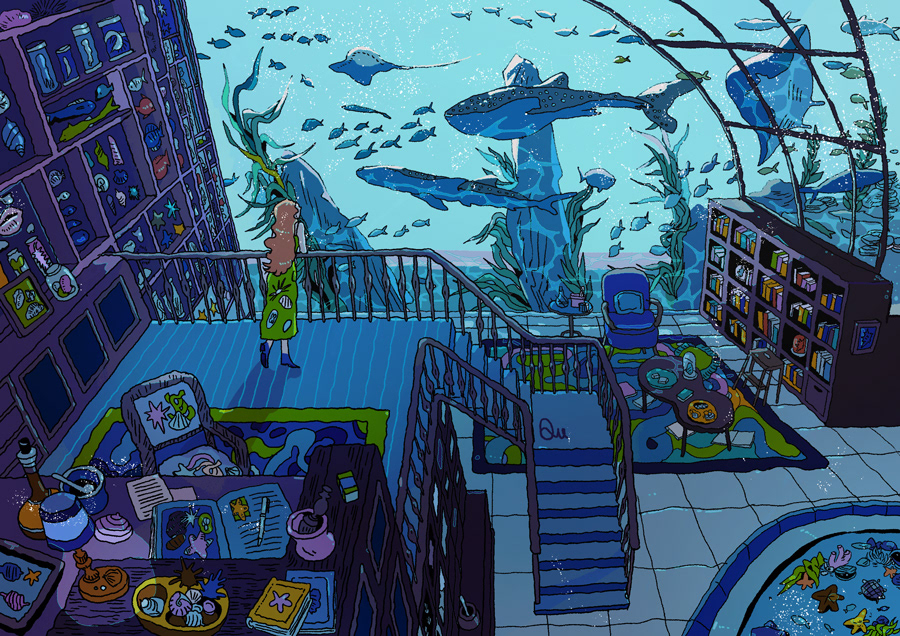
What are the coordinates of `under second set of stairs` in the screenshot? It's located at (488, 483).